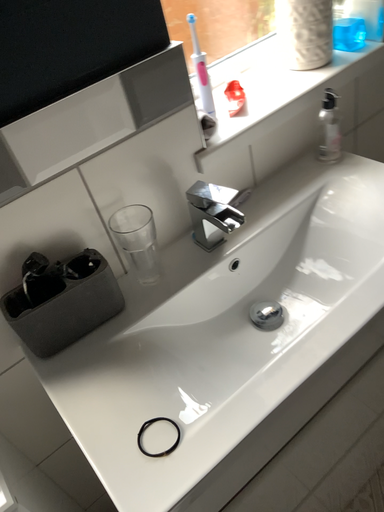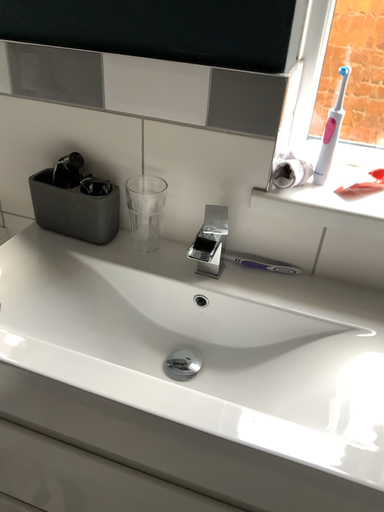
Question: How did the camera likely rotate when shooting the video?

Choices:
 (A) rotated upward
 (B) rotated downward

Answer: (A)